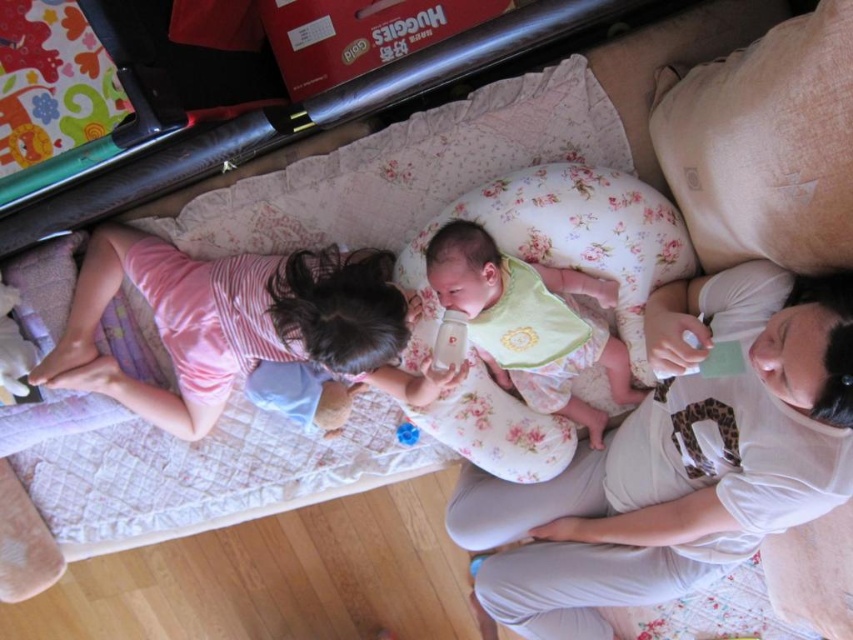
In the living room scene, there is a white cotton shirt at upper right and a pink striped shirt at upper left. Which shirt is located to the right of the other?

The white cotton shirt at upper right is positioned on the right side of the pink striped shirt at upper left.

You are a parent looking for your baby in the living room. You see the pink striped shirt at upper left and the blue rubber duck at center. Which object is higher up in the image?

Answer: The pink striped shirt at upper left is located above the blue rubber duck at center, so the pink striped shirt at upper left is higher up in the image.